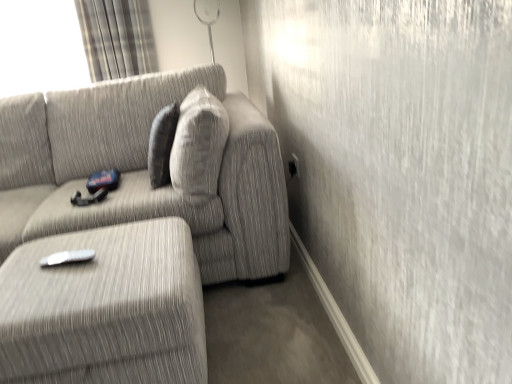
You are a GUI agent. You are given a task and a screenshot of the screen. Output one action in this format:
    pyautogui.click(x=<x>, y=<y>)
    Task: Click on the free space to the right of white plastic remote at lower left
    
    Given the screenshot: What is the action you would take?
    pyautogui.click(x=123, y=256)